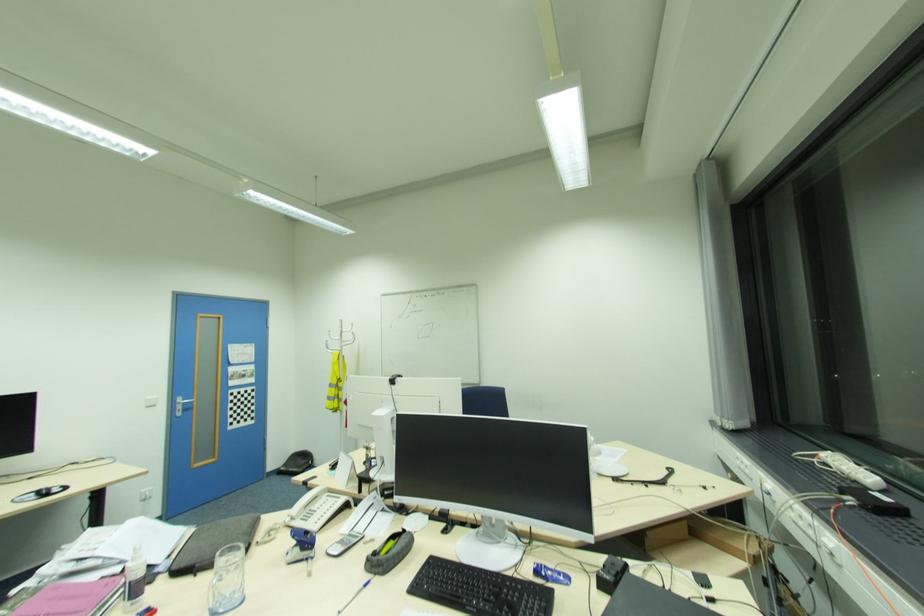
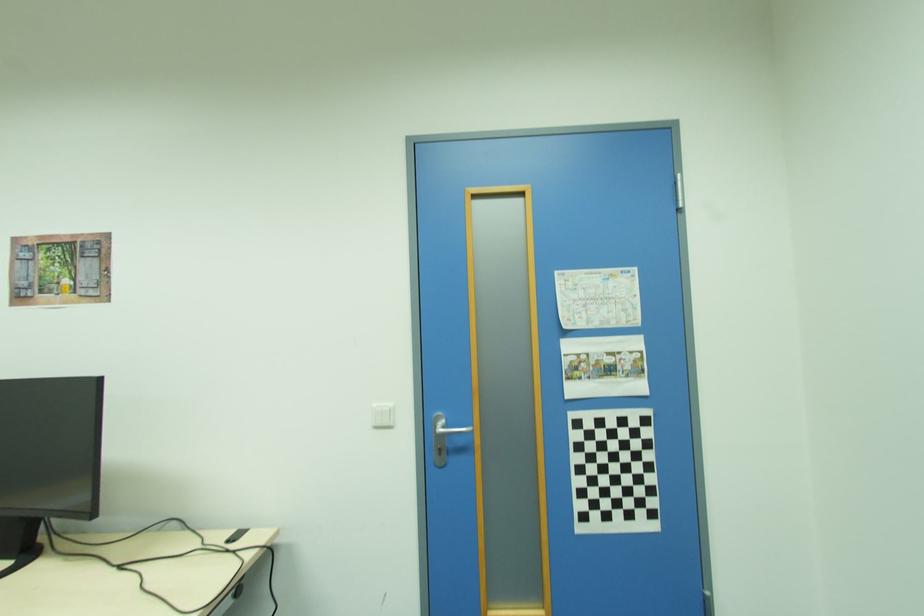
Find the pixel in the second image that matches (157,406) in the first image.

(394, 427)